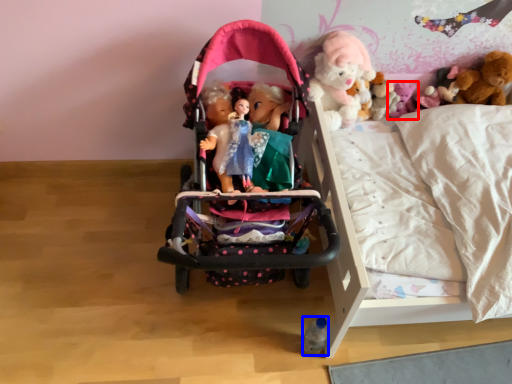
Question: Which of the following is the closest to the observer, toy (highlighted by a red box) or toy (highlighted by a blue box)?

Choices:
 (A) toy
 (B) toy

Answer: (B)